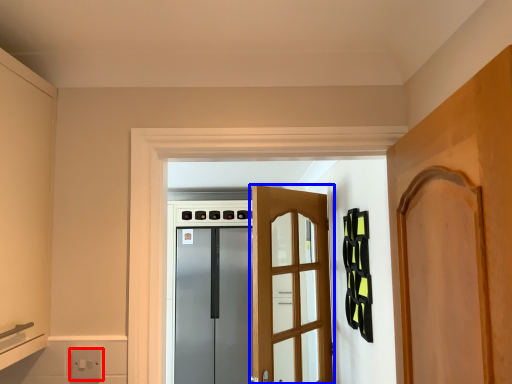
Question: Among these objects, which one is nearest to the camera, electric outlet (highlighted by a red box) or door (highlighted by a blue box)?

Choices:
 (A) electric outlet
 (B) door

Answer: (A)